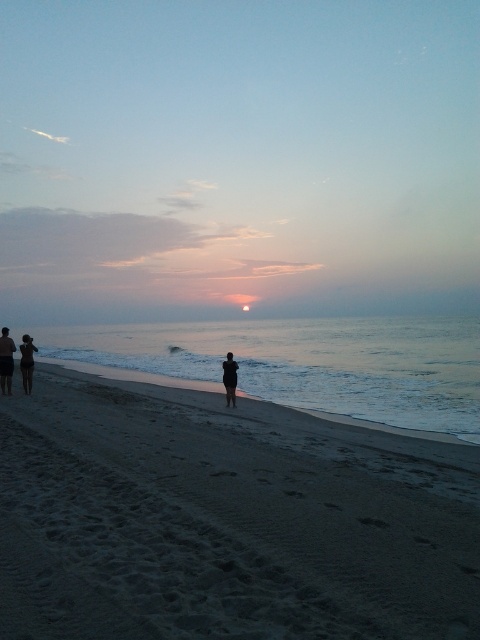
Question: Which point appears farthest from the camera in this image?

Choices:
 (A) (437, 474)
 (B) (227, 358)
 (C) (1, 342)
 (D) (23, 376)

Answer: (D)

Question: From the image, what is the correct spatial relationship of dark blue shorts at lower left in relation to silhouette figure at lower left?

Choices:
 (A) left
 (B) right

Answer: (B)

Question: Does silhouette figure at lower left appear over black matte figure at center?

Choices:
 (A) no
 (B) yes

Answer: (B)

Question: Among these points, which one is nearest to the camera?

Choices:
 (A) (231, 387)
 (B) (27, 337)
 (C) (208, 348)

Answer: (A)

Question: Can you confirm if dark blue shorts at lower left is positioned to the left of black matte figure at center?

Choices:
 (A) no
 (B) yes

Answer: (B)

Question: Among these points, which one is nearest to the camera?

Choices:
 (A) (12, 371)
 (B) (229, 355)
 (C) (32, 371)

Answer: (A)